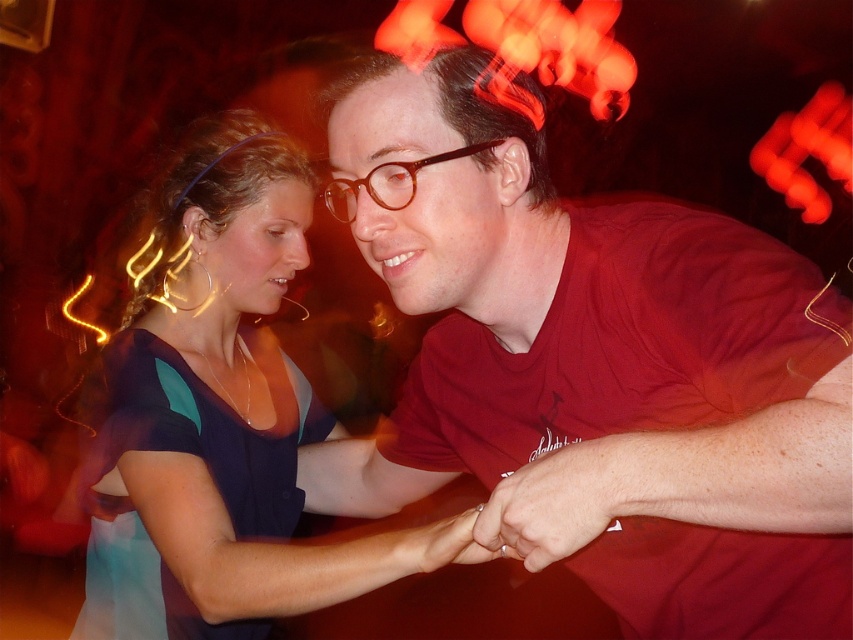
Question: Which point is farther to the camera?

Choices:
 (A) matte red shirt at center
 (B) brown glossy glasses at center

Answer: (B)

Question: Among these points, which one is nearest to the camera?

Choices:
 (A) (490, 456)
 (B) (395, 188)
 (C) (258, 557)

Answer: (B)

Question: Which of the following is the closest to the observer?

Choices:
 (A) (473, 216)
 (B) (165, 435)
 (C) (357, 198)

Answer: (A)

Question: Is matte red shirt at center closer to the viewer compared to brown glossy glasses at center?

Choices:
 (A) no
 (B) yes

Answer: (B)

Question: Is matte red shirt at center behind brown glossy glasses at center?

Choices:
 (A) no
 (B) yes

Answer: (A)

Question: Is matte red shirt at center above matte blue dress at center?

Choices:
 (A) no
 (B) yes

Answer: (A)